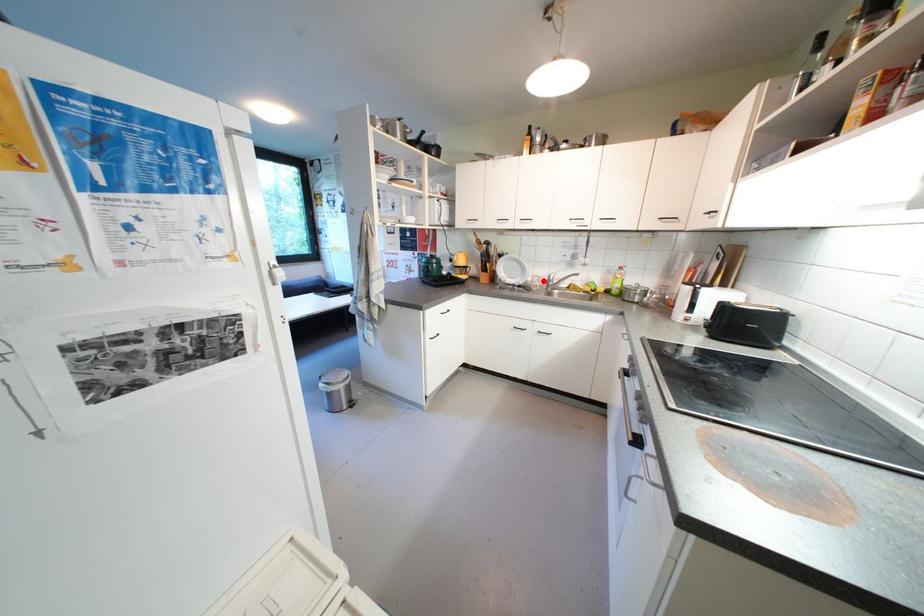
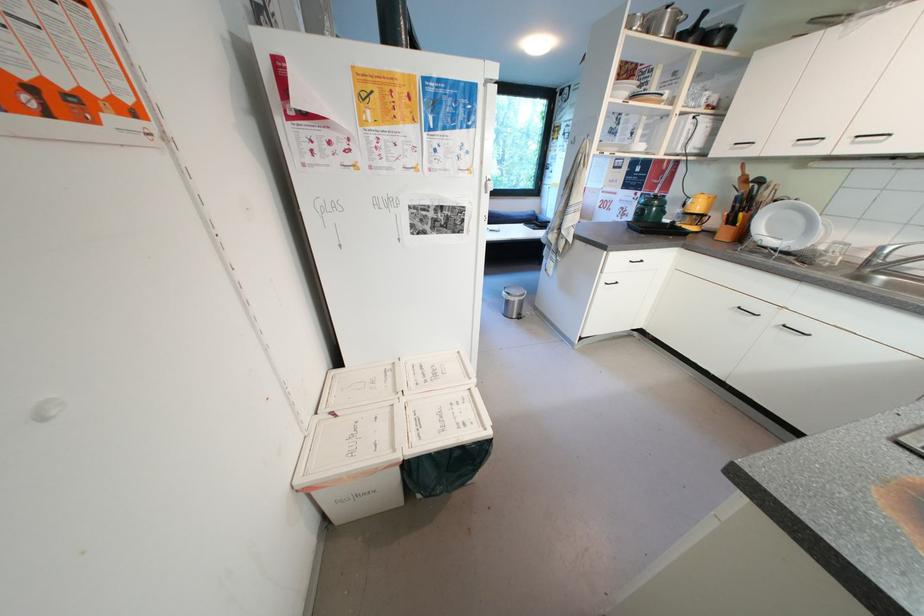
Question: A red point is marked in image1. In image2, is the corresponding 3D point closer to the camera or farther? Reply with the corresponding letter.

Choices:
 (A) The corresponding 3D point is closer.
 (B) The corresponding 3D point is farther.

Answer: (B)